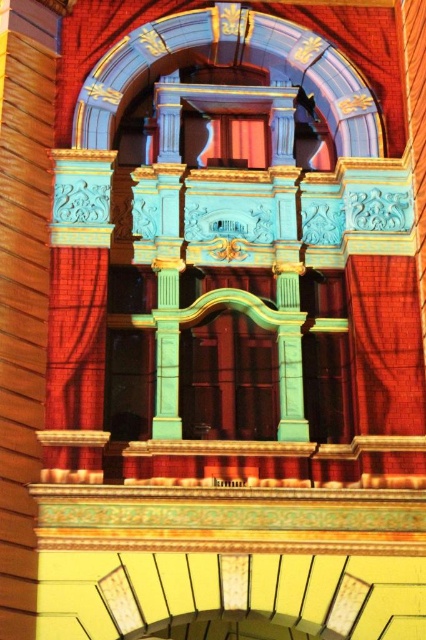
You are an interior designer planning to place a large sculpture in the space between the smooth red brick column at center and the velvet red curtain at left. Based on their sizes, which object should you consider moving to accommodate the sculpture?

The smooth red brick column at center is larger in size than the velvet red curtain at left, so you should consider moving the smooth red brick column at center to accommodate the sculpture.

You are standing in front of the building and want to touch both the smooth red brick column at center and the velvet red curtain at left. Which object should you reach for first to touch the one closer to you?

You should reach for the smooth red brick column at center first because it is closer to the viewer than the velvet red curtain at left.

Consider the image. You are standing in front of the building and notice both the smooth red brick column at center and the matte red curtain at center. Which object is positioned lower in the scene?

The smooth red brick column at center is positioned lower than the matte red curtain at center.